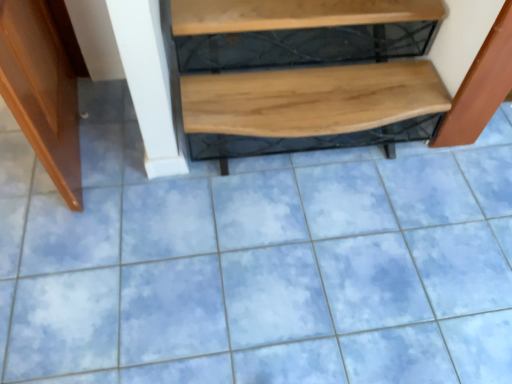
The image size is (512, 384). Identify the location of vacant position to the left of wooden bench at right. (407, 155).